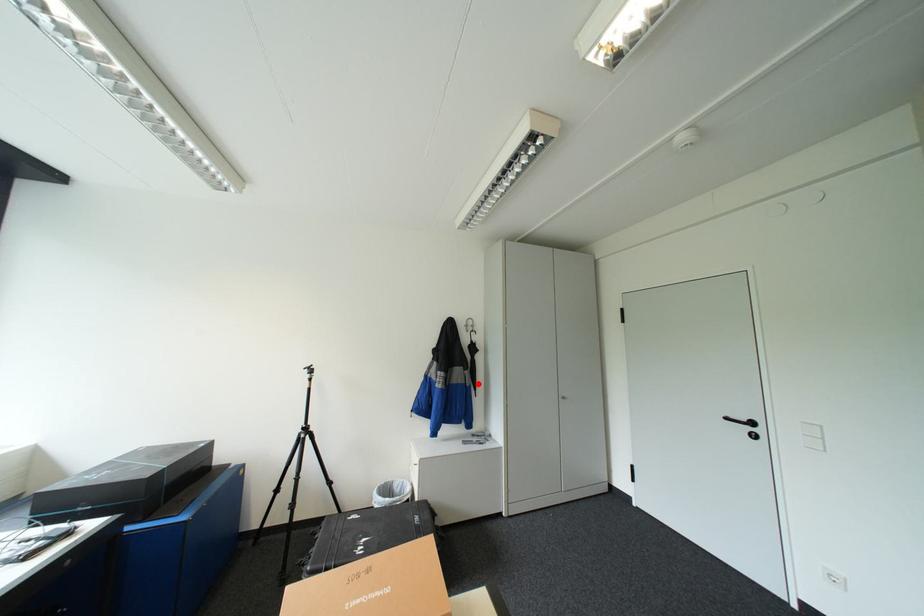
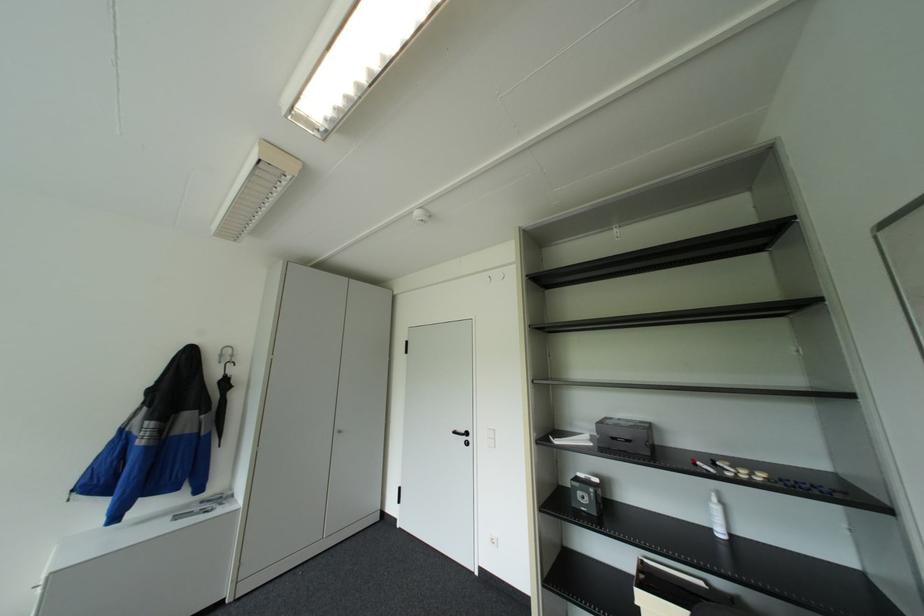
Question: I am providing you with two images of the same scene from different viewpoints. A red point is shown in image1. For the corresponding object point in image2, is it positioned nearer or farther from the camera?

Choices:
 (A) Nearer
 (B) Farther

Answer: (A)